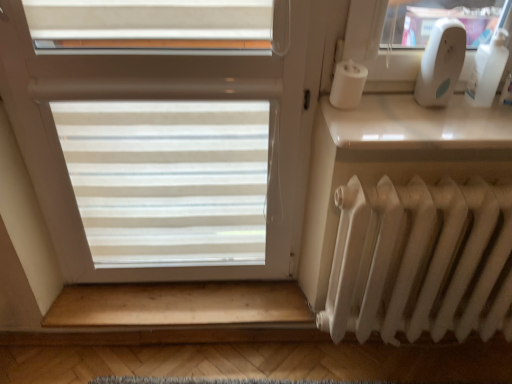
Question: Looking at their shapes, would you say white translucent blinds at center is wider or thinner than white glossy window sill at upper right?

Choices:
 (A) wide
 (B) thin

Answer: (B)

Question: Considering the positions of point (122, 246) and point (395, 96), is point (122, 246) closer or farther from the camera than point (395, 96)?

Choices:
 (A) closer
 (B) farther

Answer: (B)

Question: Based on their relative distances, which object is farther from the wooden at lower?

Choices:
 (A) white translucent blinds at center
 (B) white matte radiator at lower right
 (C) white glossy window sill at upper right
 (D) white plastic bottle at upper right

Answer: (D)

Question: Estimate the real-world distances between objects in this image. Which object is farther from the white translucent blinds at center?

Choices:
 (A) white plastic bottle at upper right
 (B) wooden at lower
 (C) white glossy window sill at upper right
 (D) white matte radiator at lower right

Answer: (A)